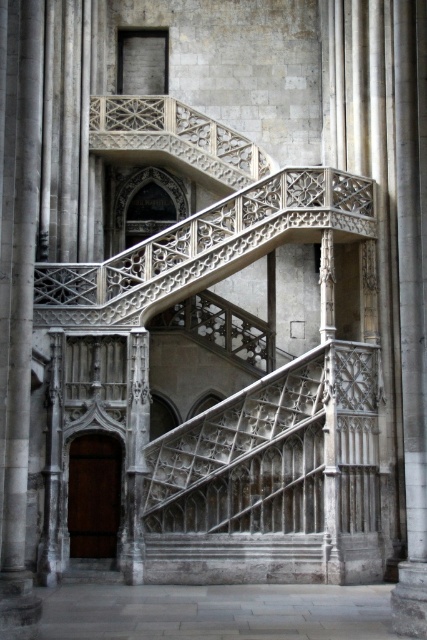
Question: Is white stone staircase at center in front of carved stone balustrade at center?

Choices:
 (A) yes
 (B) no

Answer: (B)

Question: Does white stone staircase at center have a smaller size compared to gray stone pillar at center?

Choices:
 (A) yes
 (B) no

Answer: (A)

Question: Considering the real-world distances, which object is farthest from the smooth stone pillar at center?

Choices:
 (A) gray stone pillar at center
 (B) carved stone balustrade at center
 (C) white stone staircase at center

Answer: (A)

Question: Which object is closer to the camera taking this photo?

Choices:
 (A) gray stone pillar at center
 (B) carved stone balustrade at center
 (C) smooth stone pillar at center

Answer: (A)

Question: Does white stone staircase at center appear over smooth stone pillar at center?

Choices:
 (A) yes
 (B) no

Answer: (B)

Question: Which of the following is the farthest from the observer?

Choices:
 (A) carved stone balustrade at center
 (B) smooth stone pillar at center
 (C) white stone staircase at center
 (D) gray stone pillar at center

Answer: (C)